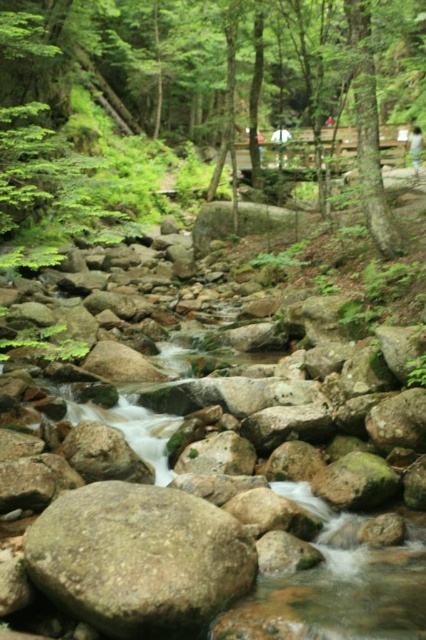
You are standing at the wooden bridge in the background and want to walk to the gray rough boulder at center. Which direction should you head relative to the green matte tree at upper center?

You should head to the left side of the green matte tree at upper center because the gray rough boulder at center is positioned to the left of the green matte tree at upper center according to the description.

You are standing at the edge of the stream and want to walk towards the wooden bridge in the background. Which object will you encounter first, the green matte tree at upper center or the gray rough boulder at center?

You will encounter the green matte tree at upper center first because it is closer to you than the gray rough boulder at center.